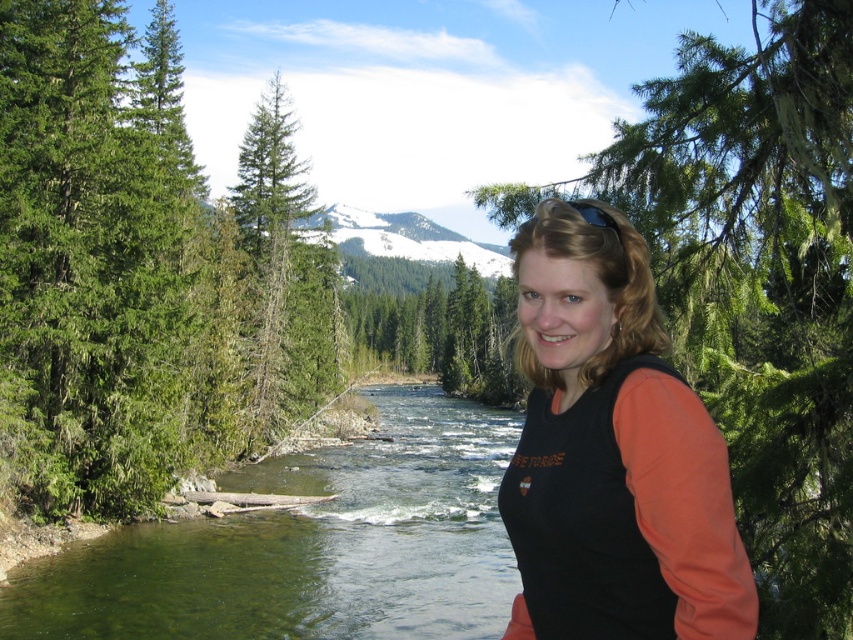
You are a hiker who wants to take a photo of the green leafy tree at center and the green coniferous trees at left. Which one should you focus on first if you want both to be in clear focus?

You should focus on the green coniferous trees at left first because they are closer to you than the green leafy tree at center. This ensures that both will be in focus when using depth of field appropriately.

You are a photographer planning to take a photo of the two trees in the scene. Given that the green leafy tree at center and the green matte tree at center are both in the frame, which tree would appear taller in the photo?

The green leafy tree at center would appear taller in the photo because it has a greater height compared to the green matte tree at center.

You are a photographer trying to capture the black matte shirt at center and the green coniferous trees at left in the same frame. Which object is located to the left of the other?

The green coniferous trees at left is positioned on the left side of black matte shirt at center.